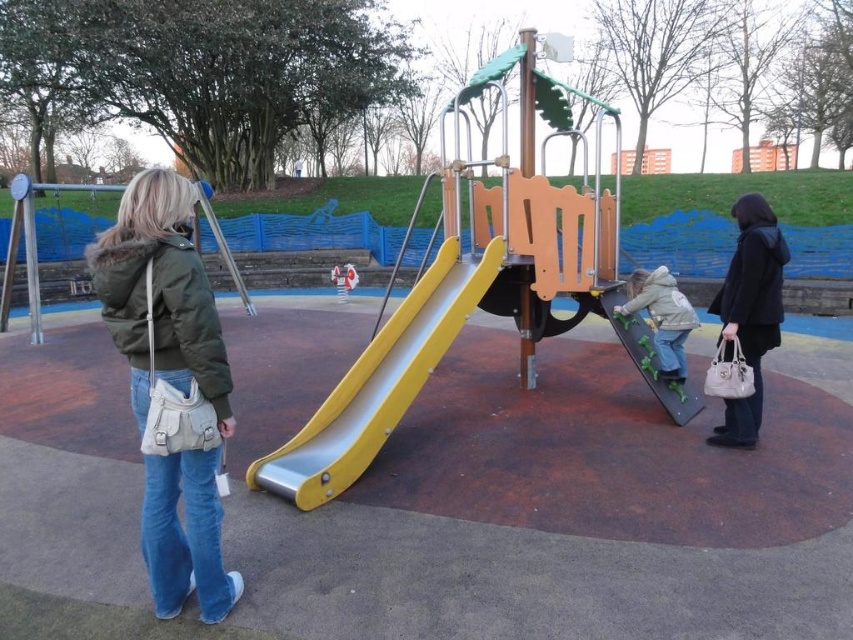
You are a photographer setting up equipment on the playground. You need to position your tripod between the matte green jacket at left and the metallic silver swing at left. Since the swing is wider, you decide to place the tripod closer to the narrower object. Which object should the tripod be positioned closer to?

The tripod should be positioned closer to the matte green jacket at left because it has a lesser width compared to the metallic silver swing at left, allowing more space between them.

You are a photographer trying to capture a group photo of the two adults in the matte green jacket at left and the light gray fleece jacket at center. Since you want everyone to be in focus, you need to know which adult is taller. Which adult is taller?

The matte green jacket at left is taller than the light gray fleece jacket at center, so the adult wearing the matte green jacket at left is taller.